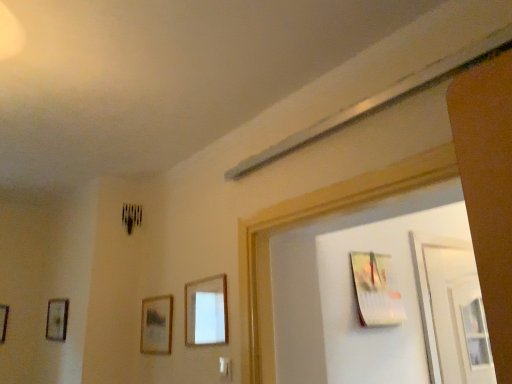
Question: Is metallic silver picture frame at upper right, the 1th picture frame when ordered from right to left, positioned with its back to wooden picture frame at left, the fifth picture frame viewed from the right?

Choices:
 (A) no
 (B) yes

Answer: (A)

Question: From a real-world perspective, is metallic silver picture frame at upper right, the 1th picture frame when ordered from right to left, physically above wooden picture frame at left, the fifth picture frame viewed from the right?

Choices:
 (A) yes
 (B) no

Answer: (A)

Question: Considering the relative sizes of metallic silver picture frame at upper right, the 1th picture frame when ordered from right to left, and wooden picture frame at left, the fifth picture frame viewed from the right, in the image provided, is metallic silver picture frame at upper right, the 1th picture frame when ordered from right to left, thinner than wooden picture frame at left, the fifth picture frame viewed from the right,?

Choices:
 (A) no
 (B) yes

Answer: (A)

Question: Is metallic silver picture frame at upper right, the 5th picture frame when ordered from left to right, aimed at wooden picture frame at left, the fifth picture frame viewed from the right?

Choices:
 (A) yes
 (B) no

Answer: (B)

Question: From the image's perspective, is metallic silver picture frame at upper right, the 1th picture frame when ordered from right to left, on wooden picture frame at left, which ranks as the 1th picture frame in left-to-right order?

Choices:
 (A) yes
 (B) no

Answer: (A)

Question: Is wooden picture frame at center, acting as the 2th picture frame starting from the right, spatially inside metallic silver picture frame at upper right, the 5th picture frame when ordered from left to right, or outside of it?

Choices:
 (A) inside
 (B) outside

Answer: (B)

Question: In terms of height, does wooden picture frame at center, acting as the 2th picture frame starting from the right, look taller or shorter compared to metallic silver picture frame at upper right, the 1th picture frame when ordered from right to left?

Choices:
 (A) short
 (B) tall

Answer: (A)

Question: From a real-world perspective, relative to metallic silver picture frame at upper right, the 1th picture frame when ordered from right to left, is wooden picture frame at center, positioned as the fourth picture frame in left-to-right order, vertically above or below?

Choices:
 (A) below
 (B) above

Answer: (A)

Question: Is wooden picture frame at center, positioned as the fourth picture frame in left-to-right order, to the left or to the right of metallic silver picture frame at upper right, the 1th picture frame when ordered from right to left, in the image?

Choices:
 (A) right
 (B) left

Answer: (B)

Question: Considering the positions of metallic silver picture frame at upper right, the 5th picture frame when ordered from left to right, and wooden picture frame at left, which is counted as the fourth picture frame, starting from the right, in the image, is metallic silver picture frame at upper right, the 5th picture frame when ordered from left to right, bigger or smaller than wooden picture frame at left, which is counted as the fourth picture frame, starting from the right,?

Choices:
 (A) small
 (B) big

Answer: (B)

Question: From a real-world perspective, is metallic silver picture frame at upper right, the 5th picture frame when ordered from left to right, physically located above or below wooden picture frame at left, the 2th picture frame positioned from the left?

Choices:
 (A) above
 (B) below

Answer: (A)

Question: Would you say metallic silver picture frame at upper right, the 5th picture frame when ordered from left to right, is inside or outside wooden picture frame at left, the 2th picture frame positioned from the left?

Choices:
 (A) inside
 (B) outside

Answer: (B)

Question: Looking at their shapes, would you say metallic silver picture frame at upper right, the 5th picture frame when ordered from left to right, is wider or thinner than wooden picture frame at left, the 2th picture frame positioned from the left?

Choices:
 (A) wide
 (B) thin

Answer: (A)

Question: Do you think wooden picture frame at left, which is counted as the fourth picture frame, starting from the right, is within metallic silver picture frame at upper right, the 1th picture frame when ordered from right to left, or outside of it?

Choices:
 (A) outside
 (B) inside

Answer: (A)

Question: Is wooden picture frame at left, which is counted as the fourth picture frame, starting from the right, to the left or to the right of metallic silver picture frame at upper right, the 1th picture frame when ordered from right to left, in the image?

Choices:
 (A) left
 (B) right

Answer: (A)